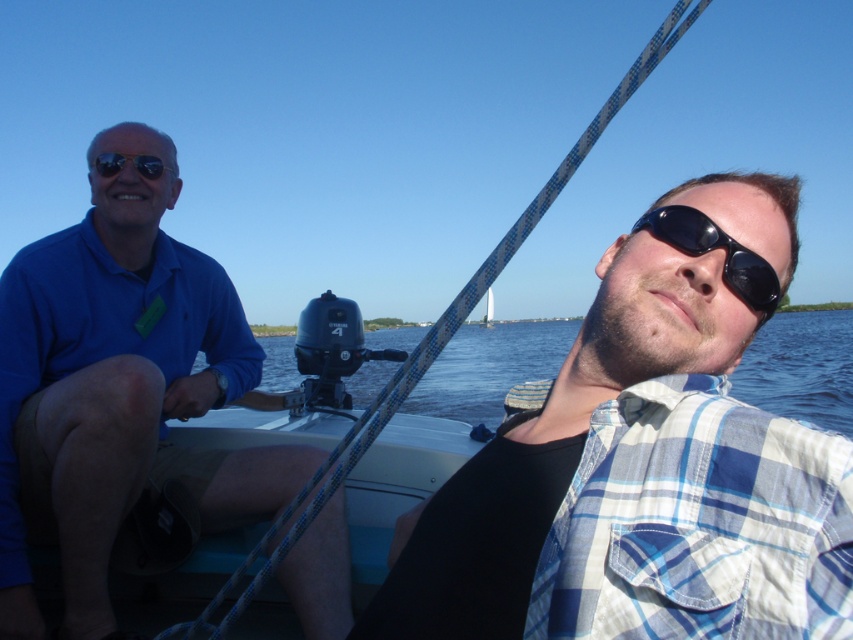
Between blue plaid shirt at center and black reflective sunglasses at center, which one appears on the right side from the viewer's perspective?

From the viewer's perspective, black reflective sunglasses at center appears more on the right side.

Can you confirm if blue plaid shirt at center is thinner than black reflective sunglasses at center?

In fact, blue plaid shirt at center might be wider than black reflective sunglasses at center.

Who is more forward, (497, 588) or (775, 307)?

Point (497, 588)

Find the location of a particular element. The image size is (853, 640). blue plaid shirt at center is located at coordinates (647, 465).

Is matte blue shirt at left closer to camera compared to blue water at center?

No, it is not.

Between matte blue shirt at left and blue water at center, which one appears on the right side from the viewer's perspective?

blue water at center is more to the right.

Does point (10, 474) lie behind point (364, 385)?

No, (10, 474) is in front of (364, 385).

Find the location of a particular element. This screenshot has height=640, width=853. matte blue shirt at left is located at coordinates (117, 387).

Which is above, blue water at center or black reflective sunglasses at center?

black reflective sunglasses at center

Measure the distance from blue water at center to black reflective sunglasses at center.

They are 39.03 meters apart.

This screenshot has width=853, height=640. In order to click on blue water at center in this screenshot , I will do `click(799, 369)`.